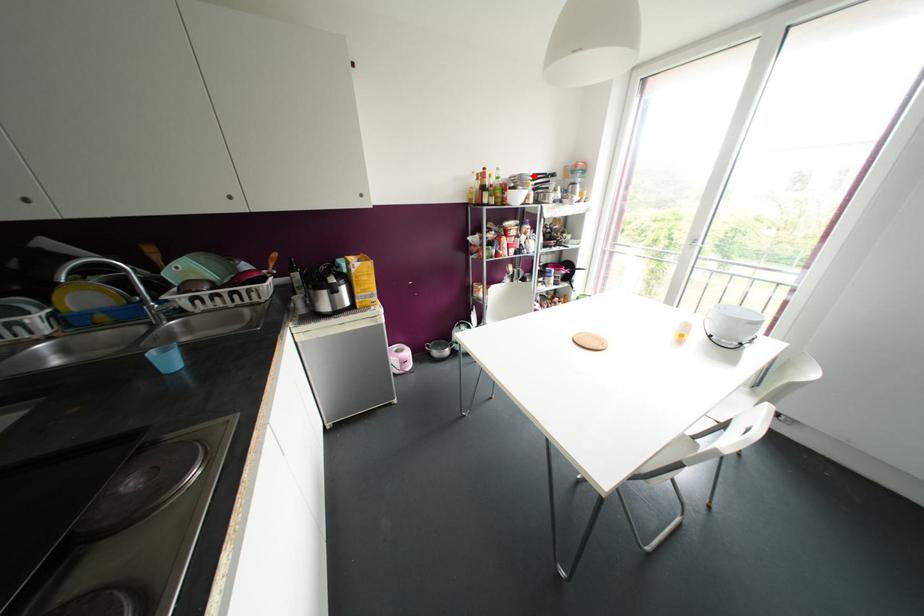
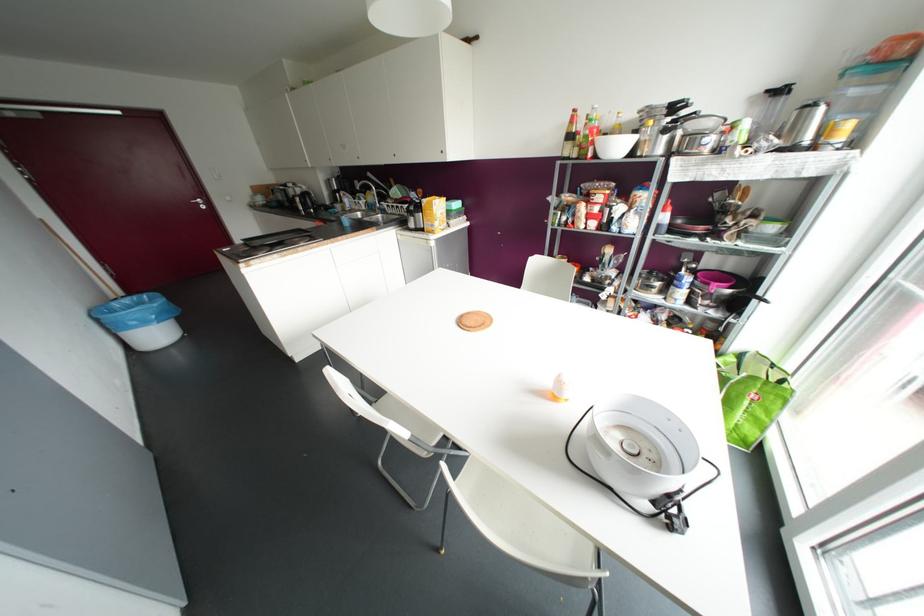
The point at the highlighted location is marked in the first image. Where is the corresponding point in the second image?

(673, 107)